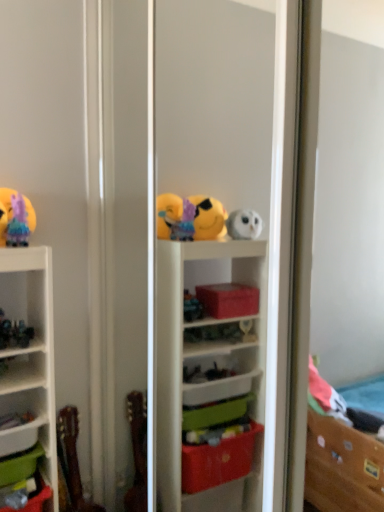
Question: Does pastel rainbow tulle at upper left, which is the first toy in top-to-bottom order, lie behind green plastic storage box at lower left, which ranks as the 1th storage box in bottom-to-top order?

Choices:
 (A) yes
 (B) no

Answer: (A)

Question: Does pastel rainbow tulle at upper left, which is the first toy in top-to-bottom order, have a greater width compared to green plastic storage box at lower left, which ranks as the 1th storage box in bottom-to-top order?

Choices:
 (A) yes
 (B) no

Answer: (A)

Question: Does pastel rainbow tulle at upper left, which is the 3th toy from bottom to top, have a smaller size compared to green plastic storage box at lower left, which ranks as the 1th storage box in bottom-to-top order?

Choices:
 (A) no
 (B) yes

Answer: (B)

Question: Could you tell me if pastel rainbow tulle at upper left, which is the first toy in top-to-bottom order, is facing green plastic storage box at lower left, which ranks as the 1th storage box in bottom-to-top order?

Choices:
 (A) yes
 (B) no

Answer: (B)

Question: Is pastel rainbow tulle at upper left, which is the first toy in top-to-bottom order, to the right of green plastic storage box at lower left, which ranks as the 1th storage box in bottom-to-top order, from the viewer's perspective?

Choices:
 (A) no
 (B) yes

Answer: (B)

Question: From a real-world perspective, is wooden guitar at lower left, marked as the first toy in a bottom-to-top arrangement, above or below green plastic storage box at lower left, the 2th storage box ordered from the bottom?

Choices:
 (A) below
 (B) above

Answer: (A)

Question: Is wooden guitar at lower left, the third toy in the top-to-bottom sequence, situated inside green plastic storage box at lower left, the 2th storage box ordered from the bottom, or outside?

Choices:
 (A) outside
 (B) inside

Answer: (A)

Question: Considering the positions of wooden guitar at lower left, the third toy in the top-to-bottom sequence, and green plastic storage box at lower left, which is the first storage box from top to bottom, in the image, is wooden guitar at lower left, the third toy in the top-to-bottom sequence, taller or shorter than green plastic storage box at lower left, which is the first storage box from top to bottom,?

Choices:
 (A) short
 (B) tall

Answer: (B)

Question: Is wooden guitar at lower left, marked as the first toy in a bottom-to-top arrangement, bigger or smaller than green plastic storage box at lower left, the 2th storage box ordered from the bottom?

Choices:
 (A) small
 (B) big

Answer: (B)

Question: Looking at the image, does metallic green figurine at left, which is the 2th toy from bottom to top, seem bigger or smaller compared to green plastic storage box at lower left, the second storage box when ordered from top to bottom?

Choices:
 (A) small
 (B) big

Answer: (A)

Question: Visually, is metallic green figurine at left, arranged as the 2th toy when viewed from the top, positioned to the left or to the right of green plastic storage box at lower left, the second storage box when ordered from top to bottom?

Choices:
 (A) right
 (B) left

Answer: (A)

Question: Is metallic green figurine at left, arranged as the 2th toy when viewed from the top, situated inside green plastic storage box at lower left, which ranks as the 1th storage box in bottom-to-top order, or outside?

Choices:
 (A) outside
 (B) inside

Answer: (A)

Question: From the image's perspective, is metallic green figurine at left, which is the 2th toy from bottom to top, located above or below green plastic storage box at lower left, the second storage box when ordered from top to bottom?

Choices:
 (A) above
 (B) below

Answer: (A)

Question: From a real-world perspective, relative to pastel rainbow tulle at upper left, which is the first toy in top-to-bottom order, is green plastic storage box at lower left, which is the first storage box from top to bottom, vertically above or below?

Choices:
 (A) above
 (B) below

Answer: (B)

Question: Relative to pastel rainbow tulle at upper left, which is the 3th toy from bottom to top, is green plastic storage box at lower left, which is the first storage box from top to bottom, in front or behind?

Choices:
 (A) behind
 (B) front

Answer: (A)